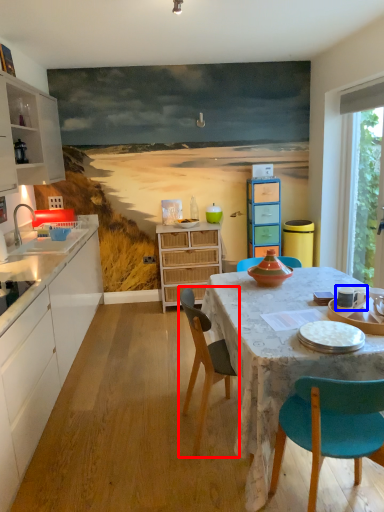
Question: Which of the following is the closest to the observer, chair (highlighted by a red box) or tableware (highlighted by a blue box)?

Choices:
 (A) chair
 (B) tableware

Answer: (A)